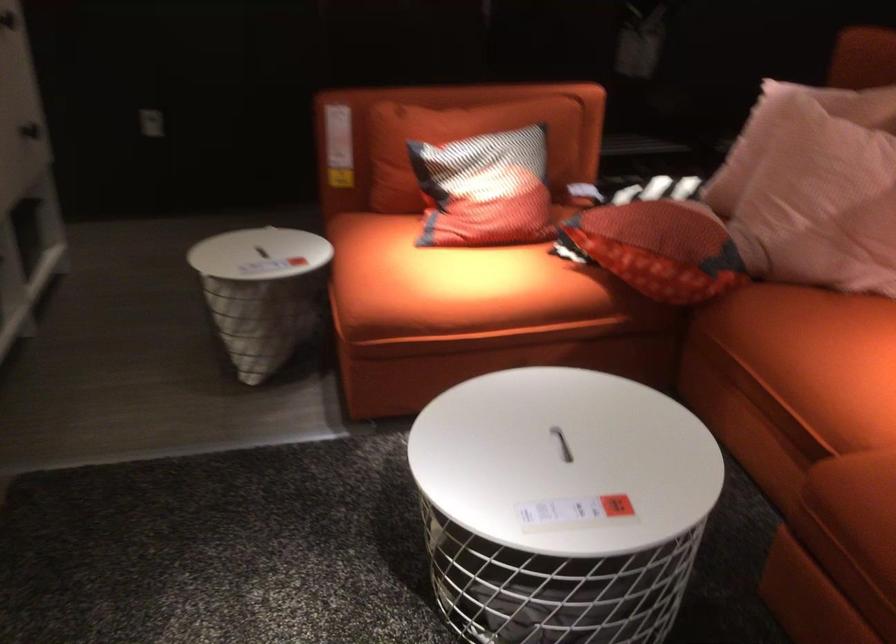
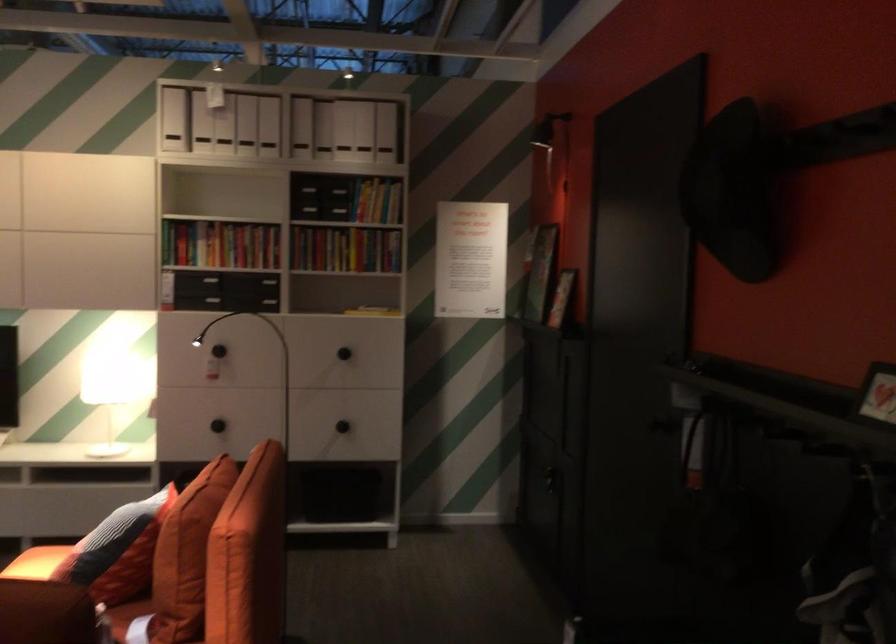
Where in the second image is the point corresponding to the point at 576,118 from the first image?

(186, 554)